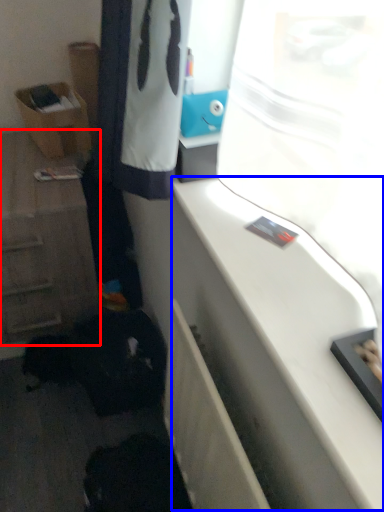
Question: Which object appears farthest to the camera in this image, cabinetry (highlighted by a red box) or counter top (highlighted by a blue box)?

Choices:
 (A) cabinetry
 (B) counter top

Answer: (A)